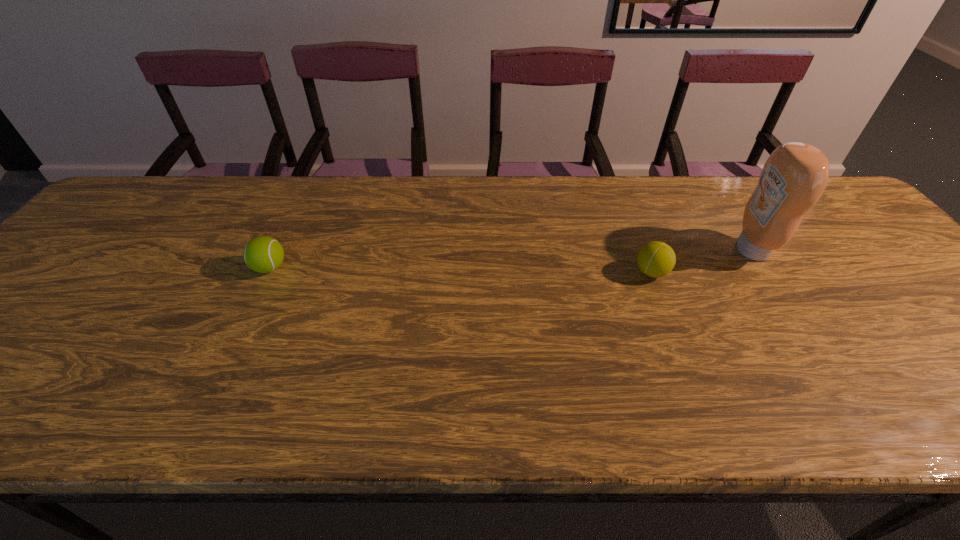
This screenshot has height=540, width=960. I want to click on the rightmost object, so click(795, 175).

The width and height of the screenshot is (960, 540). I want to click on the tallest object, so click(x=795, y=175).

Locate an element on the screen. Image resolution: width=960 pixels, height=540 pixels. the left tennis ball is located at coordinates (263, 254).

This screenshot has width=960, height=540. Find the location of `the right tennis ball`. the right tennis ball is located at coordinates (656, 259).

Where is `vacant area situated 0.100m on the label of the rightmost object`? Image resolution: width=960 pixels, height=540 pixels. vacant area situated 0.100m on the label of the rightmost object is located at coordinates (696, 250).

What are the coordinates of `vacant point located on the label of the rightmost object` in the screenshot? It's located at (715, 250).

At what (x,y) coordinates should I click in order to perform the action: click on vacant point located 0.100m on the label of the rightmost object. Please return your answer as a coordinate pair (x, y). Looking at the image, I should click on (696, 250).

Locate an element on the screen. This screenshot has height=540, width=960. vacant space situated 0.150m on the back of the leftmost object is located at coordinates (293, 220).

I want to click on vacant area situated 0.320m on the back of the second object from right to left, so [x=619, y=190].

At what (x,y) coordinates should I click in order to perform the action: click on vacant space at the far edge of the desktop. Please return your answer as a coordinate pair (x, y). The width and height of the screenshot is (960, 540). Looking at the image, I should click on (722, 213).